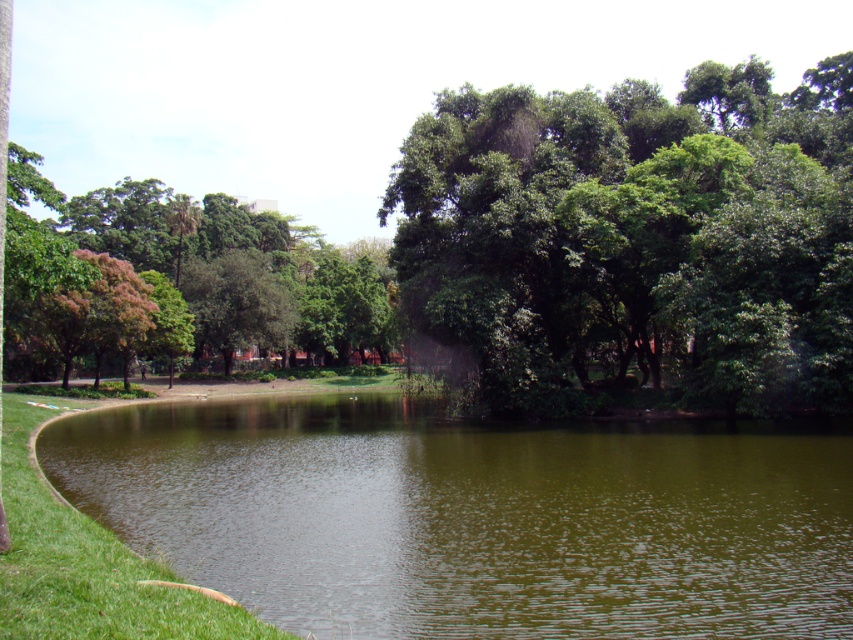
Does green liquid water at center have a lesser height compared to green leafy tree at center?

Yes, green liquid water at center is shorter than green leafy tree at center.

Who is more distant from viewer, (756, 499) or (474, 138)?

Positioned behind is point (474, 138).

Between point (206, 404) and point (708, 140), which one is positioned in front?

Point (708, 140) is more forward.

Find the location of a particular element. The image size is (853, 640). green liquid water at center is located at coordinates (474, 516).

Does green leafy tree at center appear on the left side of green leafy tree at upper left?

No, green leafy tree at center is not to the left of green leafy tree at upper left.

Which is in front, point (718, 177) or point (96, 349)?

Point (718, 177) is in front.

Where is `green leafy tree at center`? The height and width of the screenshot is (640, 853). green leafy tree at center is located at coordinates (639, 234).

Is green leafy tree at center to the left of green grass at lower left from the viewer's perspective?

No, green leafy tree at center is not to the left of green grass at lower left.

Does green leafy tree at center come in front of green grass at lower left?

That is False.

Which is behind, point (699, 68) or point (45, 531)?

The point (699, 68) is more distant.

This screenshot has height=640, width=853. In order to click on green leafy tree at center in this screenshot , I will do `click(639, 234)`.